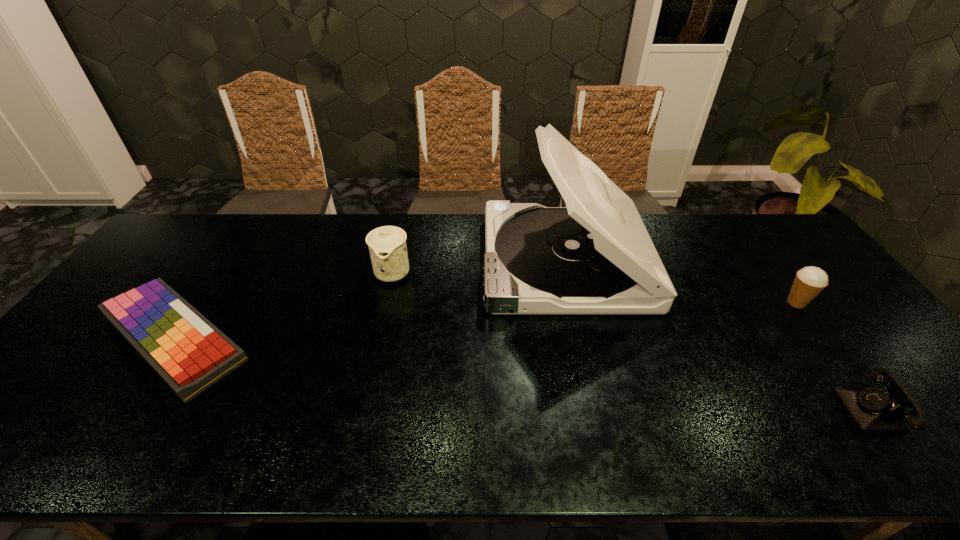
At what (x,y) coordinates should I click in order to perform the action: click on object that is at the left edge. Please return your answer as a coordinate pair (x, y). The image size is (960, 540). Looking at the image, I should click on (190, 353).

What are the coordinates of `icecream present at the right edge` in the screenshot? It's located at (809, 281).

This screenshot has height=540, width=960. Find the location of `telephone located in the right edge section of the desktop`. telephone located in the right edge section of the desktop is located at coordinates (872, 410).

Find the location of a particular element. object present at the near right corner is located at coordinates (872, 410).

You are a GUI agent. You are given a task and a screenshot of the screen. Output one action in this format:
    pyautogui.click(x=<x>, y=<y>)
    Task: Click on the free space at the far edge
    The height and width of the screenshot is (540, 960).
    Given the screenshot: What is the action you would take?
    pyautogui.click(x=434, y=225)

The width and height of the screenshot is (960, 540). In the image, there is a desktop. What are the coordinates of `vacant region at the near edge` in the screenshot? It's located at (430, 443).

In the image, there is a desktop. At what (x,y) coordinates should I click in order to perform the action: click on free space at the right edge. Please return your answer as a coordinate pair (x, y). Looking at the image, I should click on (856, 325).

Locate an element on the screen. Image resolution: width=960 pixels, height=540 pixels. vacant space at the far left corner of the desktop is located at coordinates (194, 237).

You are a GUI agent. You are given a task and a screenshot of the screen. Output one action in this format:
    pyautogui.click(x=<x>, y=<y>)
    Task: Click on the empty space that is in between the telephone and the leftmost object
    The width and height of the screenshot is (960, 540).
    Given the screenshot: What is the action you would take?
    pyautogui.click(x=522, y=369)

This screenshot has width=960, height=540. I want to click on empty space that is in between the CD player and the second tallest object, so click(479, 267).